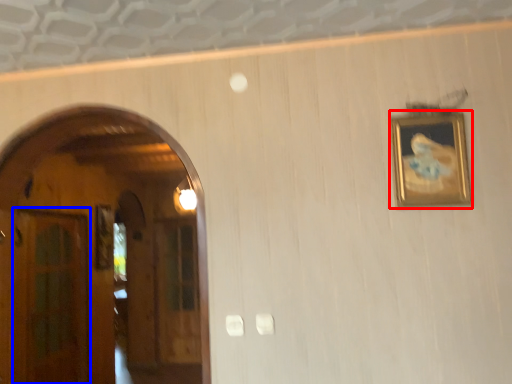
Question: Which point is closer to the camera, picture frame (highlighted by a red box) or glass door (highlighted by a blue box)?

Choices:
 (A) picture frame
 (B) glass door

Answer: (A)